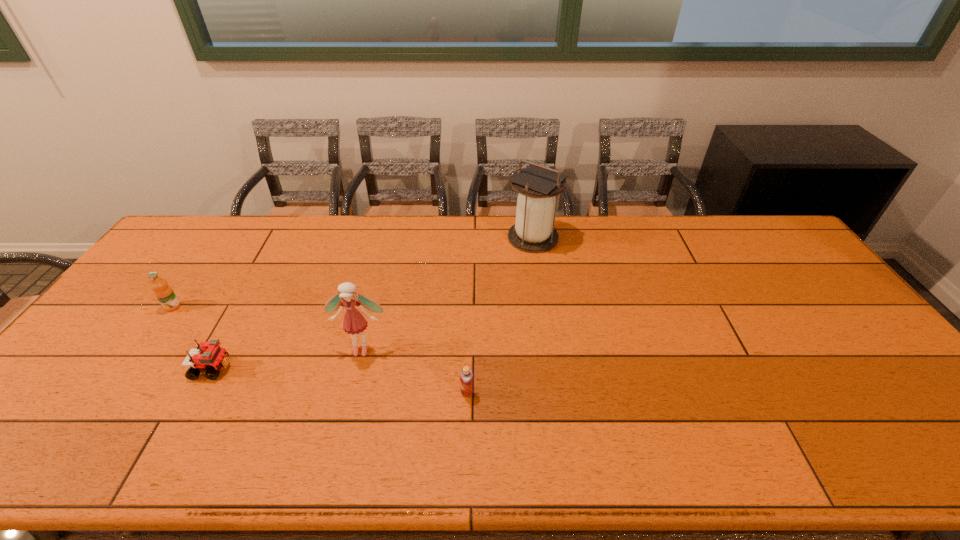
Locate which object is the second closest to the farthest object. Please provide its 2D coordinates. Your answer should be formatted as a tuple, i.e. [(x, y)], where the tuple contains the x and y coordinates of a point satisfying the conditions above.

[(466, 376)]

Identify the location of vacant space that satisfies the following two spatial constraints: 1. on the label of the shorter orange juice; 2. on the left side of the taller orange juice. [111, 393].

Locate an element on the screen. vacant region that satisfies the following two spatial constraints: 1. on the label of the right orange juice; 2. on the right side of the left orange juice is located at coordinates (111, 393).

Where is `vacant space that satisfies the following two spatial constraints: 1. on the front-facing side of the Lego; 2. on the right side of the right orange juice`? This screenshot has height=540, width=960. vacant space that satisfies the following two spatial constraints: 1. on the front-facing side of the Lego; 2. on the right side of the right orange juice is located at coordinates (199, 393).

Identify the location of vacant region that satisfies the following two spatial constraints: 1. on the front side of the lantern; 2. on the front-facing side of the Lego. (552, 368).

This screenshot has height=540, width=960. In order to click on vacant region that satisfies the following two spatial constraints: 1. on the front side of the farthest object; 2. on the front-facing side of the fourth object from right to left in this screenshot , I will do `click(552, 368)`.

What are the coordinates of `vacant space that satisfies the following two spatial constraints: 1. on the front-facing side of the doll; 2. on the left side of the shorter orange juice` in the screenshot? It's located at (350, 393).

What are the coordinates of `vacant position in the image that satisfies the following two spatial constraints: 1. on the front-facing side of the right orange juice; 2. on the right side of the fourth object from right to left` in the screenshot? It's located at (199, 393).

Find the location of `vacant space that satisfies the following two spatial constraints: 1. on the front-facing side of the third object from right to left; 2. on the right side of the fourth object from left to right`. vacant space that satisfies the following two spatial constraints: 1. on the front-facing side of the third object from right to left; 2. on the right side of the fourth object from left to right is located at coordinates (350, 393).